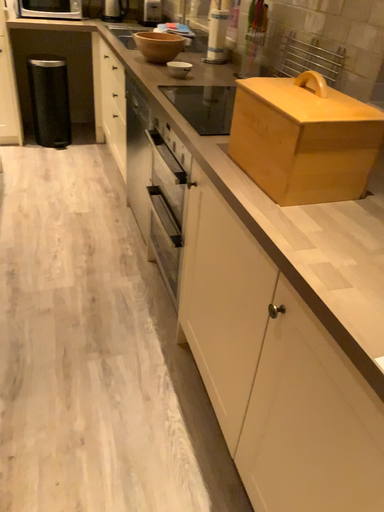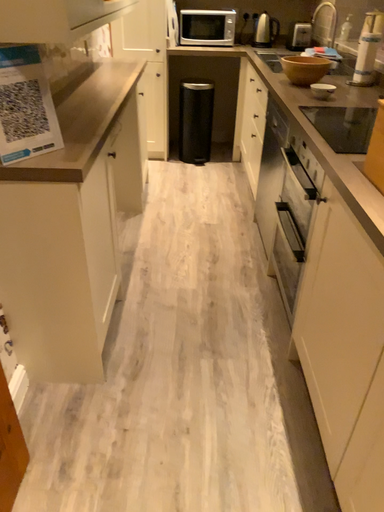
Question: How did the camera likely rotate when shooting the video?

Choices:
 (A) rotated left
 (B) rotated right

Answer: (A)